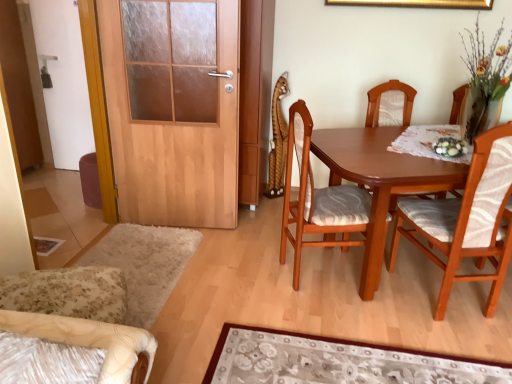
Question: From a real-world perspective, does wooden chair with patterned cushion at center, the second chair from the left, stand above floral carpet at lower center?

Choices:
 (A) yes
 (B) no

Answer: (A)

Question: Is wooden chair with patterned cushion at center, positioned as the third chair in right-to-left order, smaller than floral carpet at lower center?

Choices:
 (A) yes
 (B) no

Answer: (B)

Question: Can you confirm if wooden chair with patterned cushion at center, positioned as the third chair in right-to-left order, is positioned to the right of floral carpet at lower center?

Choices:
 (A) no
 (B) yes

Answer: (A)

Question: Is wooden chair with patterned cushion at center, positioned as the third chair in right-to-left order, shorter than floral carpet at lower center?

Choices:
 (A) yes
 (B) no

Answer: (B)

Question: Is wooden chair with patterned cushion at center, positioned as the third chair in right-to-left order, surrounding floral carpet at lower center?

Choices:
 (A) no
 (B) yes

Answer: (A)

Question: Can you confirm if wooden chair with patterned cushion at center, positioned as the third chair in right-to-left order, is thinner than floral carpet at lower center?

Choices:
 (A) yes
 (B) no

Answer: (A)

Question: Is floral carpet at lower center positioned before gold metallic picture frame at upper center?

Choices:
 (A) yes
 (B) no

Answer: (A)

Question: From the image's perspective, is floral carpet at lower center over gold metallic picture frame at upper center?

Choices:
 (A) no
 (B) yes

Answer: (A)

Question: Is gold metallic picture frame at upper center at the back of floral carpet at lower center?

Choices:
 (A) yes
 (B) no

Answer: (B)

Question: Considering the relative positions of floral carpet at lower center and gold metallic picture frame at upper center in the image provided, is floral carpet at lower center to the left of gold metallic picture frame at upper center from the viewer's perspective?

Choices:
 (A) yes
 (B) no

Answer: (A)

Question: Is floral carpet at lower center next to gold metallic picture frame at upper center?

Choices:
 (A) yes
 (B) no

Answer: (B)

Question: Can you confirm if floral carpet at lower center is smaller than gold metallic picture frame at upper center?

Choices:
 (A) yes
 (B) no

Answer: (B)

Question: Could you tell me if gold metallic picture frame at upper center is facing white glossy door at left?

Choices:
 (A) yes
 (B) no

Answer: (B)